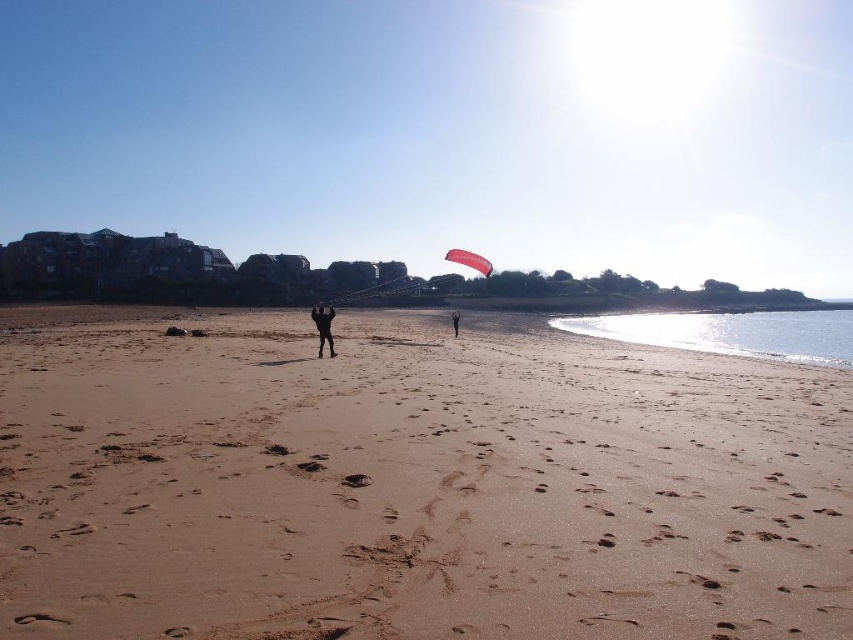
From the picture: Who is more distant from viewer, (242, 452) or (456, 316)?

The point (456, 316) is behind.

Is point (473, 488) in front of point (453, 314)?

Yes, point (473, 488) is closer to viewer.

Where is `smooth sand at center`? Image resolution: width=853 pixels, height=640 pixels. smooth sand at center is located at coordinates (410, 483).

Describe the element at coordinates (323, 326) in the screenshot. I see `black fabric person at center` at that location.

Which is in front, point (328, 328) or point (476, 257)?

Point (328, 328) is in front.

Between point (329, 305) and point (463, 262), which one is positioned behind?

The point (463, 262) is behind.

In order to click on black fabric person at center in this screenshot , I will do `click(323, 326)`.

Is white glossy parachute at center above black fabric kite at center?

Yes, white glossy parachute at center is above black fabric kite at center.

Can you confirm if white glossy parachute at center is positioned to the right of black fabric kite at center?

Correct, you'll find white glossy parachute at center to the right of black fabric kite at center.

Is point (476, 257) closer to viewer compared to point (453, 330)?

Yes, it is in front of point (453, 330).

Identify the location of white glossy parachute at center. (469, 260).